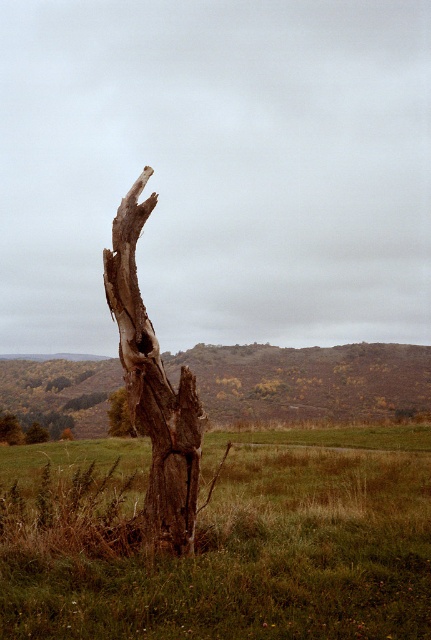
Who is positioned more to the left, green grassy at center or brown rough bark tree at center?

Positioned to the left is brown rough bark tree at center.

Between point (427, 467) and point (109, 417), which one is positioned in front?

Positioned in front is point (427, 467).

Find the location of a particular element. The width and height of the screenshot is (431, 640). green grassy at center is located at coordinates 222,541.

Who is positioned more to the right, green grassy at center or brown rough bark tree trunk at center?

brown rough bark tree trunk at center

Image resolution: width=431 pixels, height=640 pixels. What are the coordinates of `green grassy at center` in the screenshot? It's located at (222, 541).

Who is more distant from viewer, (52, 627) or (180, 436)?

Point (180, 436)

Find the location of a particular element. green grassy at center is located at coordinates (222, 541).

Does point (178, 464) come closer to viewer compared to point (109, 404)?

Yes, point (178, 464) is in front of point (109, 404).

Between point (153, 170) and point (112, 392), which one is positioned behind?

The point (112, 392) is behind.

Is point (115, 268) farther from viewer compared to point (118, 413)?

No, it is not.

The width and height of the screenshot is (431, 640). I want to click on brown rough bark tree trunk at center, so click(x=153, y=387).